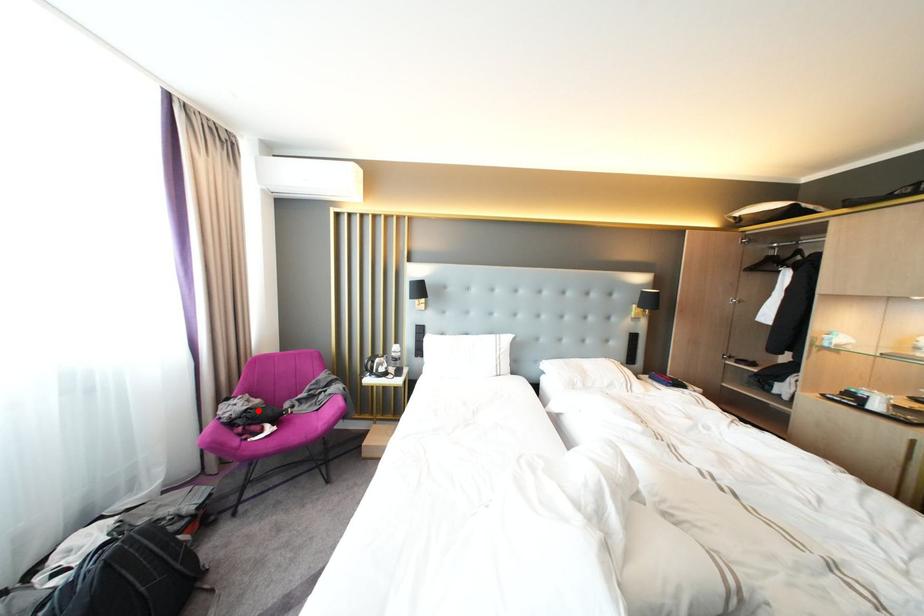
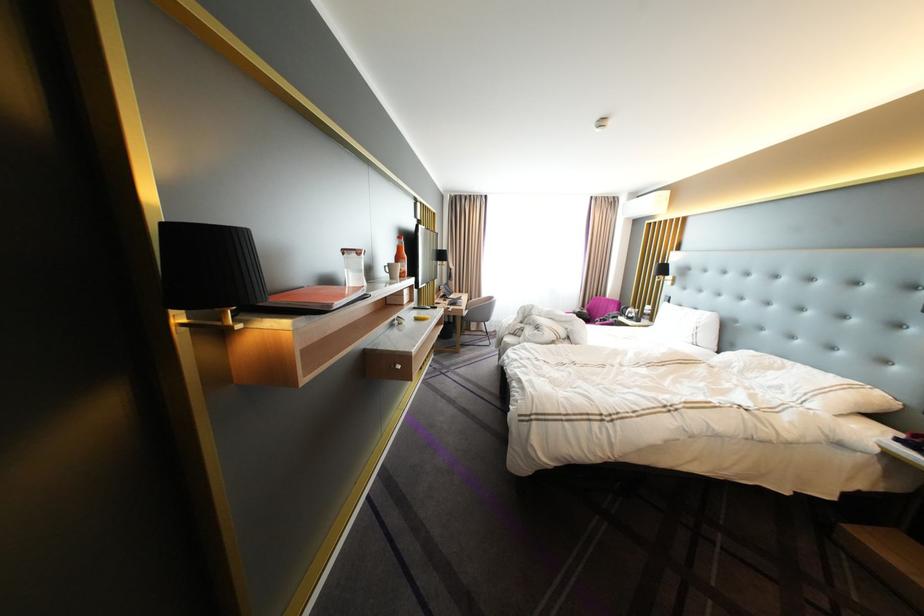
Locate, in the second image, the point that corresponds to the highlighted location in the first image.

(590, 313)